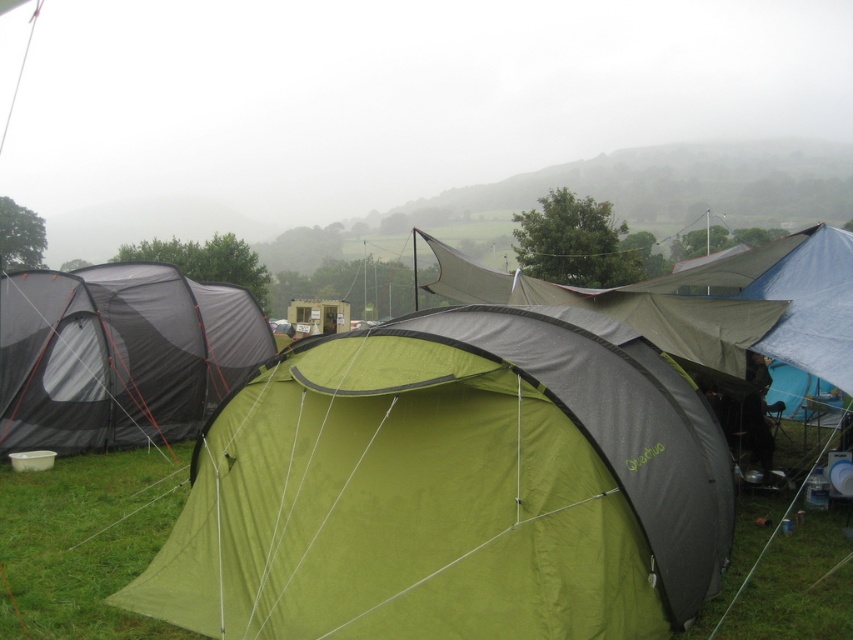
You are planning to set up a new tent in this camping area. The black mesh tent at left and the green fabric canopy at center are already present. Based on their sizes, which one would require more space to accommodate a larger tent next to it?

The green fabric canopy at center requires more space to accommodate a larger tent next to it because it has a larger size compared to the black mesh tent at left.

You are planning to set up a picnic blanket between the green fabric tent at center and the black mesh tent at left. Given that the picnic blanket is 1.5 meters wide, will there be enough space between the two tents to place it without overlapping either tent?

The green fabric tent at center is wider than the black mesh tent at left. However, the exact distance between them isn

You are standing in the camping scene and want to set up a picnic table that is 6 feet long. The picnic table must be placed exactly 30 feet away from where you are standing. Is there enough space between you and the black mesh tent at left to place the picnic table without it overlapping with the tent?

The black mesh tent at left is 29.74 feet from the viewer. Since the picnic table needs to be placed exactly 30 feet away, there is only a 0.26 feet difference. This minimal distance means the picnic table would overlap with the black mesh tent at left, so it is not possible to place it without overlapping.